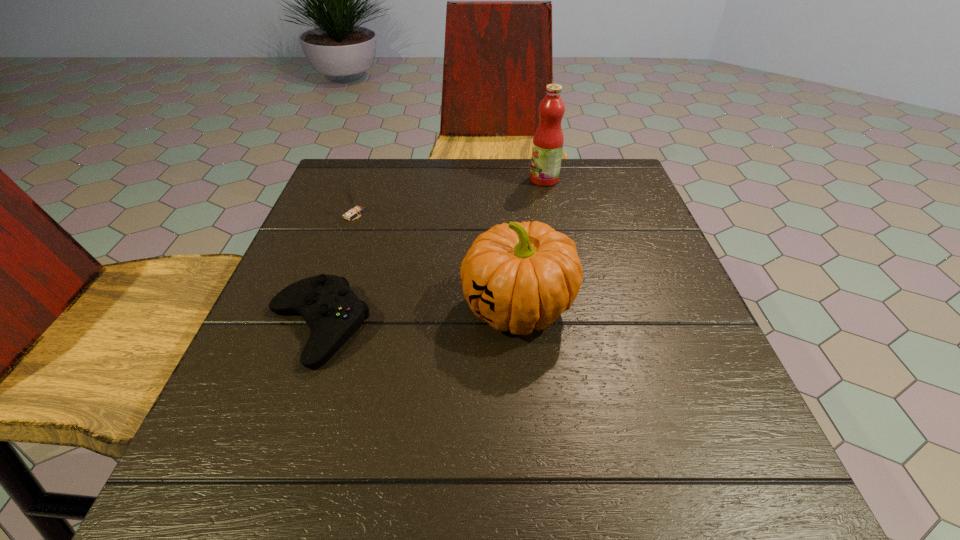
This screenshot has height=540, width=960. What are the coordinates of `vacant area situated 0.310m on the surface of the pumpkin` in the screenshot? It's located at (291, 308).

I want to click on vacant position located 0.320m on the surface of the pumpkin, so click(285, 308).

Locate an element on the screen. The height and width of the screenshot is (540, 960). vacant space located on the front of the matchbox is located at coordinates (333, 271).

The width and height of the screenshot is (960, 540). I want to click on free location located on the back of the shortest object, so click(x=368, y=184).

This screenshot has width=960, height=540. What are the coordinates of `fruit juice present at the far edge` in the screenshot? It's located at (547, 147).

Where is `matchbox at the far edge`? matchbox at the far edge is located at coordinates (355, 209).

At what (x,y) coordinates should I click in order to perform the action: click on matchbox at the left edge. Please return your answer as a coordinate pair (x, y). This screenshot has width=960, height=540. Looking at the image, I should click on tap(355, 209).

Find the location of a particular element. control that is at the left edge is located at coordinates (333, 312).

Where is `object located in the far left corner section of the desktop`? The height and width of the screenshot is (540, 960). object located in the far left corner section of the desktop is located at coordinates (355, 209).

Find the location of a particular element. This screenshot has width=960, height=540. free space at the far edge of the desktop is located at coordinates tap(414, 176).